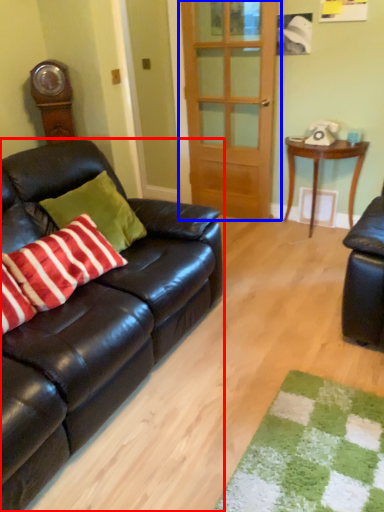
Question: Which of the following is the closest to the observer, studio couch (highlighted by a red box) or door (highlighted by a blue box)?

Choices:
 (A) studio couch
 (B) door

Answer: (A)